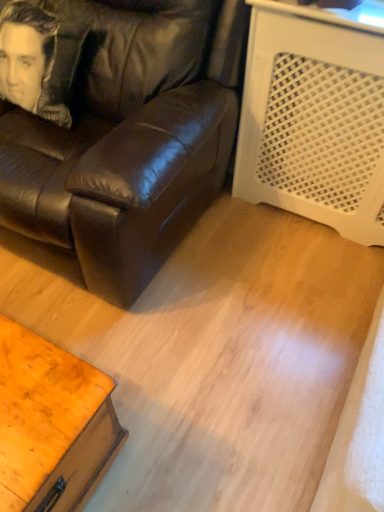
You are a GUI agent. You are given a task and a screenshot of the screen. Output one action in this format:
    pyautogui.click(x=<x>, y=<y>)
    Task: Click on the smooth leather pillow at upper left
    This screenshot has height=512, width=384.
    Given the screenshot: What is the action you would take?
    pyautogui.click(x=29, y=60)

The image size is (384, 512). What are the coordinates of `wooden table at lower left` in the screenshot? It's located at (52, 424).

Is smooth leather pillow at upper left far away from wooden table at lower left?

Indeed, smooth leather pillow at upper left is not near wooden table at lower left.

Is smooth leather pillow at upper left wider than wooden table at lower left?

Yes.

From the image's perspective, between smooth leather pillow at upper left and wooden table at lower left, who is located below?

wooden table at lower left is shown below in the image.

Do you think smooth leather pillow at upper left is within wooden table at lower left, or outside of it?

smooth leather pillow at upper left lies outside wooden table at lower left.

At what (x,y) coordinates should I click in order to perform the action: click on studio couch above the wooden table at lower left (from a real-world perspective). Please return your answer as a coordinate pair (x, y). The image size is (384, 512). Looking at the image, I should click on (128, 139).

Is wooden table at lower left far away from matte black leather couch at center?

No, there isn't a large distance between wooden table at lower left and matte black leather couch at center.

Which of these two, wooden table at lower left or matte black leather couch at center, stands taller?

Standing taller between the two is matte black leather couch at center.

Can we say wooden table at lower left lies outside matte black leather couch at center?

Yes, wooden table at lower left is not within matte black leather couch at center.

Looking at this image, does smooth leather pillow at upper left turn towards matte black leather couch at center?

Yes.

Does smooth leather pillow at upper left have a greater width compared to matte black leather couch at center?

Incorrect, the width of smooth leather pillow at upper left does not surpass that of matte black leather couch at center.

Which is closer, (45, 118) or (32, 117)?

The point (45, 118) is closer.

Is smooth leather pillow at upper left not inside matte black leather couch at center?

Actually, smooth leather pillow at upper left is within matte black leather couch at center.

Would you say matte black leather couch at center is a long distance from wooden table at lower left?

That's not correct — matte black leather couch at center is a little close to wooden table at lower left.

Would you say matte black leather couch at center is inside or outside wooden table at lower left?

matte black leather couch at center is located beyond the bounds of wooden table at lower left.

Which is more to the right, matte black leather couch at center or wooden table at lower left?

wooden table at lower left.

Considering their positions, is matte black leather couch at center located in front of or behind smooth leather pillow at upper left?

matte black leather couch at center is positioned closer to the viewer than smooth leather pillow at upper left.

Is matte black leather couch at center facing towards smooth leather pillow at upper left?

Yes, matte black leather couch at center faces towards smooth leather pillow at upper left.

Is point (214, 87) farther from camera compared to point (40, 81)?

No.

Are wooden table at lower left and smooth leather pillow at upper left located far from each other?

That's right, there is a large distance between wooden table at lower left and smooth leather pillow at upper left.

The height and width of the screenshot is (512, 384). In order to click on man above the wooden table at lower left (from a real-world perspective) in this screenshot , I will do `click(29, 60)`.

Between point (118, 426) and point (25, 49), which one is positioned behind?

The point (25, 49) is farther from the camera.

Between wooden table at lower left and smooth leather pillow at upper left, which one has smaller size?

smooth leather pillow at upper left.

Find the location of a particular element. Image resolution: width=384 pixels, height=512 pixels. man on the left of wooden table at lower left is located at coordinates (29, 60).

This screenshot has height=512, width=384. What are the coordinates of `studio couch behind the wooden table at lower left` in the screenshot? It's located at (128, 139).

Looking at the image, which one is located closer to wooden table at lower left, smooth leather pillow at upper left or matte black leather couch at center?

Among the two, matte black leather couch at center is located nearer to wooden table at lower left.

Looking at the image, which one is located closer to matte black leather couch at center, smooth leather pillow at upper left or wooden table at lower left?

Based on the image, smooth leather pillow at upper left appears to be nearer to matte black leather couch at center.

Estimate the real-world distances between objects in this image. Which object is further from smooth leather pillow at upper left, wooden table at lower left or matte black leather couch at center?

wooden table at lower left is further to smooth leather pillow at upper left.

In the scene shown: Which object lies nearer to the anchor point smooth leather pillow at upper left, matte black leather couch at center or wooden table at lower left?

matte black leather couch at center is positioned closer to the anchor smooth leather pillow at upper left.

Estimate the real-world distances between objects in this image. Which object is further from wooden table at lower left, matte black leather couch at center or smooth leather pillow at upper left?

Based on the image, smooth leather pillow at upper left appears to be further to wooden table at lower left.

From the image, which object appears to be farther from matte black leather couch at center, wooden table at lower left or smooth leather pillow at upper left?

wooden table at lower left.

Identify the location of studio couch between smooth leather pillow at upper left and wooden table at lower left from top to bottom. (128, 139).